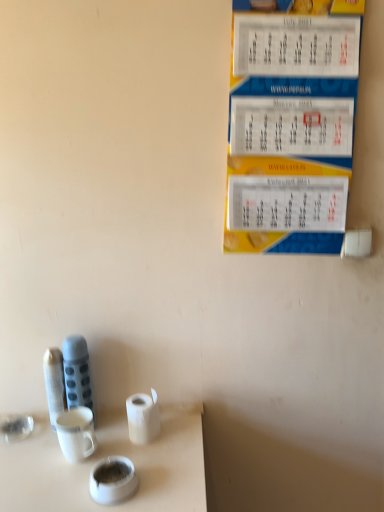
The image size is (384, 512). What do you see at coordinates (143, 417) in the screenshot? I see `white matte toilet paper at lower center` at bounding box center [143, 417].

The height and width of the screenshot is (512, 384). I want to click on white matte toilet paper at lower center, so click(x=143, y=417).

Is white glossy teacup at lower center shorter than white matte toilet paper at lower center?

Correct, white glossy teacup at lower center is not as tall as white matte toilet paper at lower center.

Does point (116, 497) come behind point (135, 415)?

No, (116, 497) is in front of (135, 415).

Identify the location of toilet paper on the right of white glossy teacup at lower center. The height and width of the screenshot is (512, 384). (143, 417).

Considering the relative positions of white glossy teacup at lower center and white matte toilet paper at lower center in the image provided, is white glossy teacup at lower center to the left or to the right of white matte toilet paper at lower center?

white glossy teacup at lower center is to the left of white matte toilet paper at lower center.

What's the angular difference between yellow paper calendar at upper right and white glossy teacup at lower center's facing directions?

They differ by 11.5 degrees in their facing directions.

The image size is (384, 512). Identify the location of teacup below the yellow paper calendar at upper right (from the image's perspective). (113, 480).

From a real-world perspective, is yellow paper calendar at upper right on white glossy teacup at lower center?

Indeed, from a real-world perspective, yellow paper calendar at upper right stands above white glossy teacup at lower center.

Can white matte toilet paper at lower center be found inside yellow paper calendar at upper right?

No, white matte toilet paper at lower center is located outside of yellow paper calendar at upper right.

Would you say yellow paper calendar at upper right is a long distance from white matte toilet paper at lower center?

yellow paper calendar at upper right is actually quite close to white matte toilet paper at lower center.

From the image's perspective, which is above, yellow paper calendar at upper right or white matte toilet paper at lower center?

yellow paper calendar at upper right appears higher in the image.

Between yellow paper calendar at upper right and white matte toilet paper at lower center, which one is positioned in front?

yellow paper calendar at upper right is in front.

From the image's perspective, between matte gray thermos at left and yellow paper calendar at upper right, which one is located above?

yellow paper calendar at upper right.

Does point (66, 351) appear closer or farther from the camera than point (278, 41)?

Point (66, 351) is farther from the camera than point (278, 41).

Would you say matte gray thermos at left is a long distance from yellow paper calendar at upper right?

That's not correct — matte gray thermos at left is a little close to yellow paper calendar at upper right.

From the image's perspective, which one is positioned lower, yellow paper calendar at upper right or matte gray thermos at left?

matte gray thermos at left is shown below in the image.

Is the surface of yellow paper calendar at upper right in direct contact with matte gray thermos at left?

No, yellow paper calendar at upper right is not next to matte gray thermos at left.

At what (x,y) coordinates should I click in order to perform the action: click on menu above the matte gray thermos at left (from the image's perspective). Please return your answer as a coordinate pair (x, y). The height and width of the screenshot is (512, 384). Looking at the image, I should click on (291, 125).

Between yellow paper calendar at upper right and matte gray thermos at left, which one appears on the right side from the viewer's perspective?

Positioned to the right is yellow paper calendar at upper right.

At what (x,y) coordinates should I click in order to perform the action: click on toilet paper lying on the right of matte gray thermos at left. Please return your answer as a coordinate pair (x, y). The image size is (384, 512). Looking at the image, I should click on (143, 417).

Is matte gray thermos at left positioned beyond the bounds of white matte toilet paper at lower center?

Yes, matte gray thermos at left is located beyond the bounds of white matte toilet paper at lower center.

In the image, is matte gray thermos at left on the left side or the right side of white matte toilet paper at lower center?

In the image, matte gray thermos at left appears on the left side of white matte toilet paper at lower center.

Is white matte toilet paper at lower center not inside matte gray thermos at left?

white matte toilet paper at lower center lies outside matte gray thermos at left's area.

Considering the relative sizes of white matte toilet paper at lower center and matte gray thermos at left in the image provided, is white matte toilet paper at lower center bigger than matte gray thermos at left?

Actually, white matte toilet paper at lower center might be smaller than matte gray thermos at left.

You are a GUI agent. You are given a task and a screenshot of the screen. Output one action in this format:
    pyautogui.click(x=<x>, y=<y>)
    Task: Click on the toilet paper on the right of matte gray thermos at left
    This screenshot has height=512, width=384.
    Given the screenshot: What is the action you would take?
    pyautogui.click(x=143, y=417)

Considering the relative sizes of white matte toilet paper at lower center and matte gray thermos at left in the image provided, is white matte toilet paper at lower center thinner than matte gray thermos at left?

No.

Image resolution: width=384 pixels, height=512 pixels. Find the location of `toilet paper above the white glossy teacup at lower center (from the image's perspective)`. toilet paper above the white glossy teacup at lower center (from the image's perspective) is located at coordinates (143, 417).

At what (x,y) coordinates should I click in order to perform the action: click on teacup directly beneath the yellow paper calendar at upper right (from a real-world perspective). Please return your answer as a coordinate pair (x, y). The width and height of the screenshot is (384, 512). Looking at the image, I should click on (113, 480).

Estimate the real-world distances between objects in this image. Which object is closer to yellow paper calendar at upper right, white glossy teacup at lower center or matte gray thermos at left?

The object closer to yellow paper calendar at upper right is matte gray thermos at left.

Which object lies nearer to the anchor point white matte toilet paper at lower center, yellow paper calendar at upper right or white glossy teacup at lower center?

Based on the image, white glossy teacup at lower center appears to be nearer to white matte toilet paper at lower center.

When comparing their distances from white glossy teacup at lower center, does matte gray thermos at left or yellow paper calendar at upper right seem further?

Among the two, yellow paper calendar at upper right is located further to white glossy teacup at lower center.

From the image, which object appears to be nearer to white matte toilet paper at lower center, white glossy teacup at lower center or matte gray thermos at left?

Among the two, white glossy teacup at lower center is located nearer to white matte toilet paper at lower center.

Based on their spatial positions, is yellow paper calendar at upper right or white matte toilet paper at lower center closer to white glossy teacup at lower center?

white matte toilet paper at lower center is closer to white glossy teacup at lower center.

Which object lies further to the anchor point white glossy teacup at lower center, yellow paper calendar at upper right or matte gray thermos at left?

yellow paper calendar at upper right lies further to white glossy teacup at lower center than the other object.

When comparing their distances from matte gray thermos at left, does white glossy teacup at lower center or yellow paper calendar at upper right seem closer?

Among the two, white glossy teacup at lower center is located nearer to matte gray thermos at left.

Estimate the real-world distances between objects in this image. Which object is closer to white matte toilet paper at lower center, yellow paper calendar at upper right or matte gray thermos at left?

The object closer to white matte toilet paper at lower center is matte gray thermos at left.

The image size is (384, 512). Find the location of `stationery that lies between yellow paper calendar at upper right and white glossy teacup at lower center from top to bottom`. stationery that lies between yellow paper calendar at upper right and white glossy teacup at lower center from top to bottom is located at coordinates point(77,373).

Locate an element on the screen. The width and height of the screenshot is (384, 512). toilet paper between yellow paper calendar at upper right and white glossy teacup at lower center from top to bottom is located at coordinates (143, 417).

Image resolution: width=384 pixels, height=512 pixels. Find the location of `toilet paper positioned between white glossy teacup at lower center and matte gray thermos at left from near to far`. toilet paper positioned between white glossy teacup at lower center and matte gray thermos at left from near to far is located at coordinates (143, 417).

At what (x,y) coordinates should I click in order to perform the action: click on stationery between yellow paper calendar at upper right and white matte toilet paper at lower center in the up-down direction. Please return your answer as a coordinate pair (x, y). The width and height of the screenshot is (384, 512). Looking at the image, I should click on (77, 373).